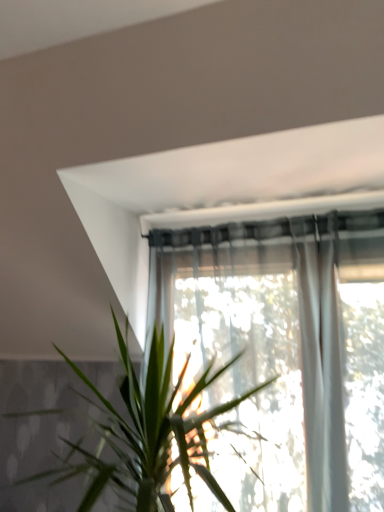
Find the location of a particular element. Image resolution: width=384 pixels, height=512 pixels. green leafy plant at center is located at coordinates tap(146, 434).

This screenshot has height=512, width=384. Describe the element at coordinates (146, 434) in the screenshot. I see `green leafy plant at center` at that location.

Where is `green leafy plant at center`? This screenshot has height=512, width=384. green leafy plant at center is located at coordinates (146, 434).